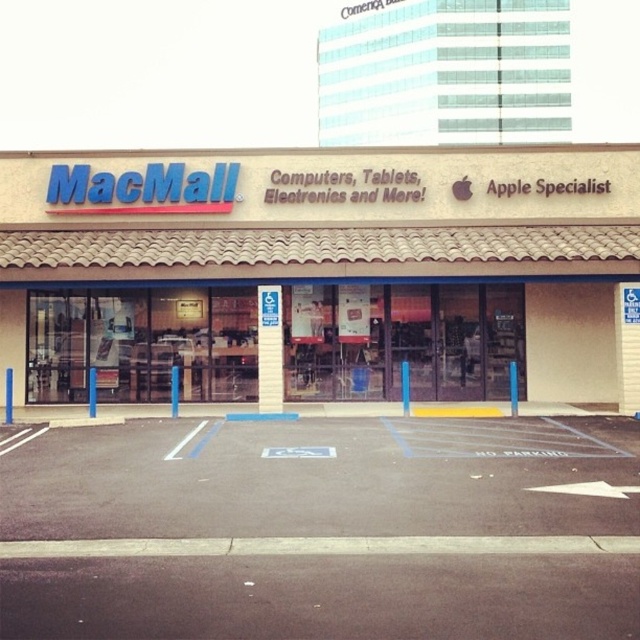
Question: Which point is closer to the camera?

Choices:
 (A) (371, 509)
 (B) (45, 177)

Answer: (A)

Question: Does beige tile macmall at center appear over black asphalt parking lot at lower center?

Choices:
 (A) no
 (B) yes

Answer: (B)

Question: Among these objects, which one is farthest from the camera?

Choices:
 (A) black asphalt parking lot at lower center
 (B) beige tile macmall at center

Answer: (B)

Question: Which point is farther from the camera taking this photo?

Choices:
 (A) (108, 196)
 (B) (632, 600)

Answer: (A)

Question: Does beige tile macmall at center have a greater width compared to black asphalt parking lot at lower center?

Choices:
 (A) no
 (B) yes

Answer: (B)

Question: Is the position of beige tile macmall at center less distant than that of black asphalt parking lot at lower center?

Choices:
 (A) yes
 (B) no

Answer: (B)